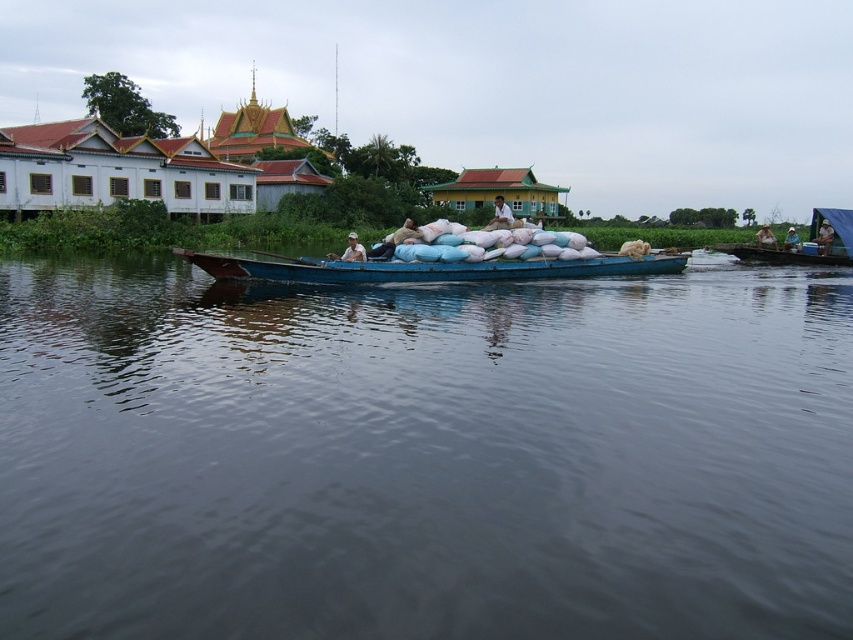
Is blue matte canoe at center in front of light brown wooden boat at right?

Yes.

Locate an element on the screen. The width and height of the screenshot is (853, 640). blue matte canoe at center is located at coordinates (424, 268).

Is point (376, 266) positioned behind point (761, 236)?

That is False.

At what (x,y) coordinates should I click in order to perform the action: click on blue matte canoe at center. Please return your answer as a coordinate pair (x, y). Looking at the image, I should click on (424, 268).

Between point (811, 262) and point (354, 252), which one is positioned behind?

Point (811, 262)

Where is `blue wooden canoe at right`? blue wooden canoe at right is located at coordinates (779, 256).

This screenshot has height=640, width=853. What are the coordinates of `blue wooden canoe at right` in the screenshot? It's located at (779, 256).